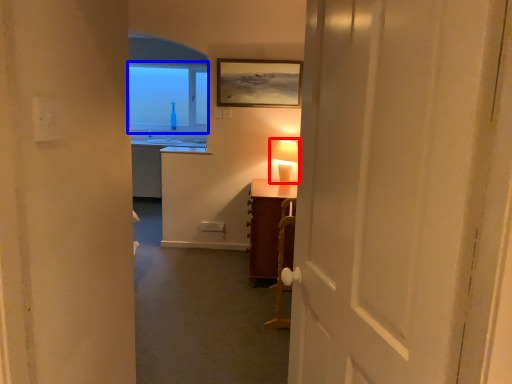
Question: Which point is closer to the camera, table lamp (highlighted by a red box) or window (highlighted by a blue box)?

Choices:
 (A) table lamp
 (B) window

Answer: (A)